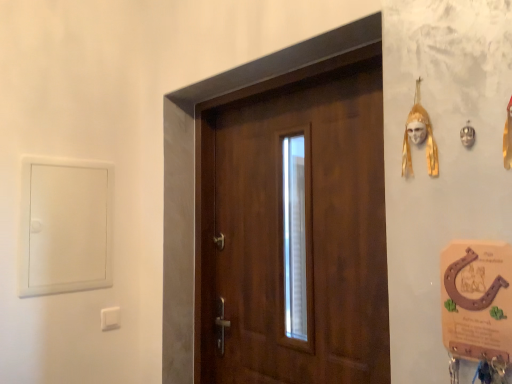
Question: Is gold metallic mask at upper right situated inside wooden door at center or outside?

Choices:
 (A) inside
 (B) outside

Answer: (B)

Question: Looking at the image, does gold metallic mask at upper right seem bigger or smaller compared to wooden door at center?

Choices:
 (A) big
 (B) small

Answer: (B)

Question: Considering the real-world distances, which object is farthest from the white plastic light switch at lower left?

Choices:
 (A) wooden door at center
 (B) gold metallic mask at upper right

Answer: (B)

Question: Which is farther from the wooden door at center?

Choices:
 (A) white plastic light switch at lower left
 (B) gold metallic mask at upper right

Answer: (A)